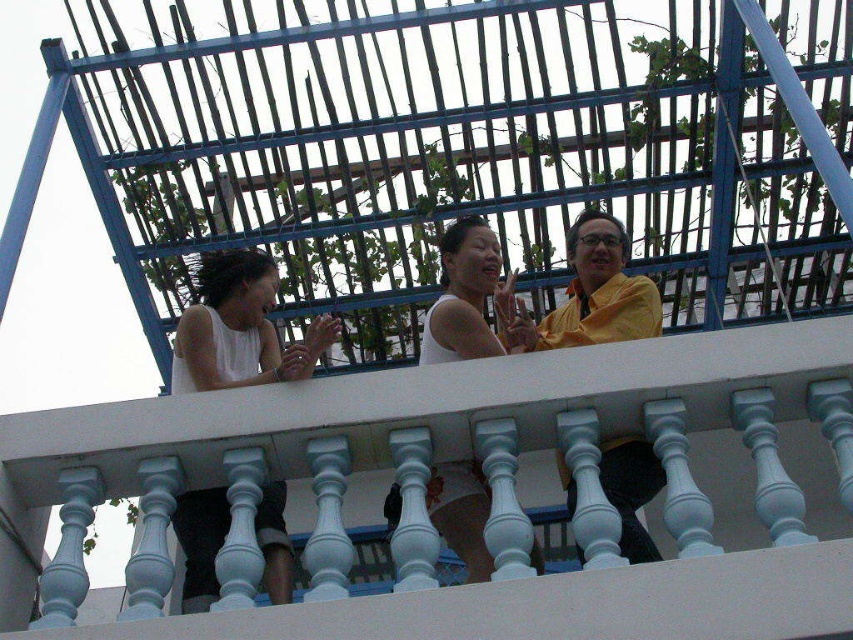
Does point (618, 454) come closer to viewer compared to point (444, 531)?

Yes, point (618, 454) is in front of point (444, 531).

Which of these two, yellow matte shirt at center or white matte tank top at center, stands shorter?

Standing shorter between the two is yellow matte shirt at center.

Describe the element at coordinates (592, 294) in the screenshot. The width and height of the screenshot is (853, 640). I see `yellow matte shirt at center` at that location.

Identify the location of yellow matte shirt at center. This screenshot has height=640, width=853. (592, 294).

Is white matte tank top at upper left below yellow matte shirt at center?

Correct, white matte tank top at upper left is located below yellow matte shirt at center.

Is white matte tank top at upper left wider than yellow matte shirt at center?

Yes.

This screenshot has height=640, width=853. I want to click on white matte tank top at upper left, so click(x=239, y=328).

You are a GUI agent. You are given a task and a screenshot of the screen. Output one action in this format:
    pyautogui.click(x=<x>, y=<y>)
    Task: Click on the white matte tank top at upper left
    The height and width of the screenshot is (640, 853).
    Given the screenshot: What is the action you would take?
    pyautogui.click(x=239, y=328)

Is white matte tank top at upper left to the right of white matte tank top at center from the viewer's perspective?

Incorrect, white matte tank top at upper left is not on the right side of white matte tank top at center.

Does point (189, 500) lie behind point (479, 336)?

No, it is in front of (479, 336).

Identify the location of white matte tank top at upper left. The image size is (853, 640). (239, 328).